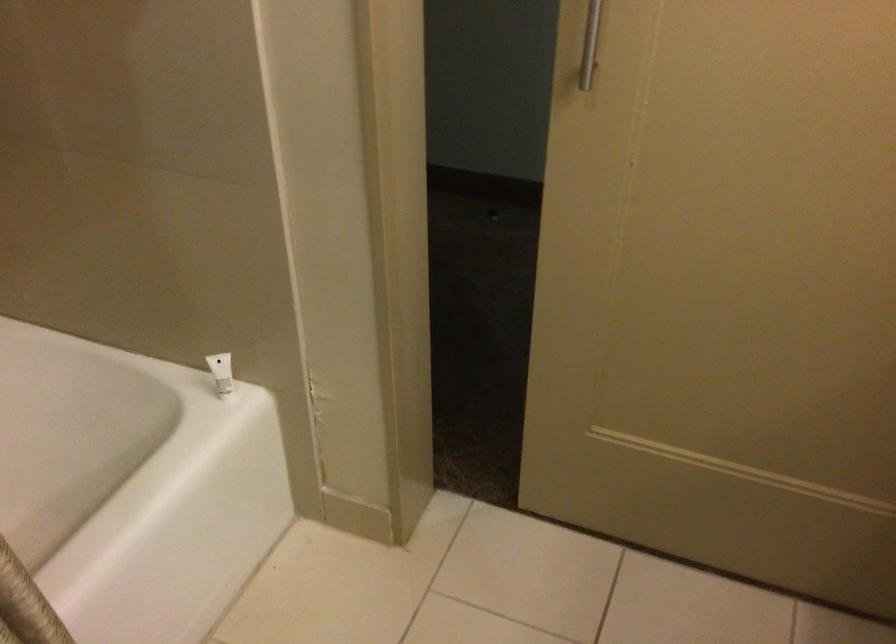
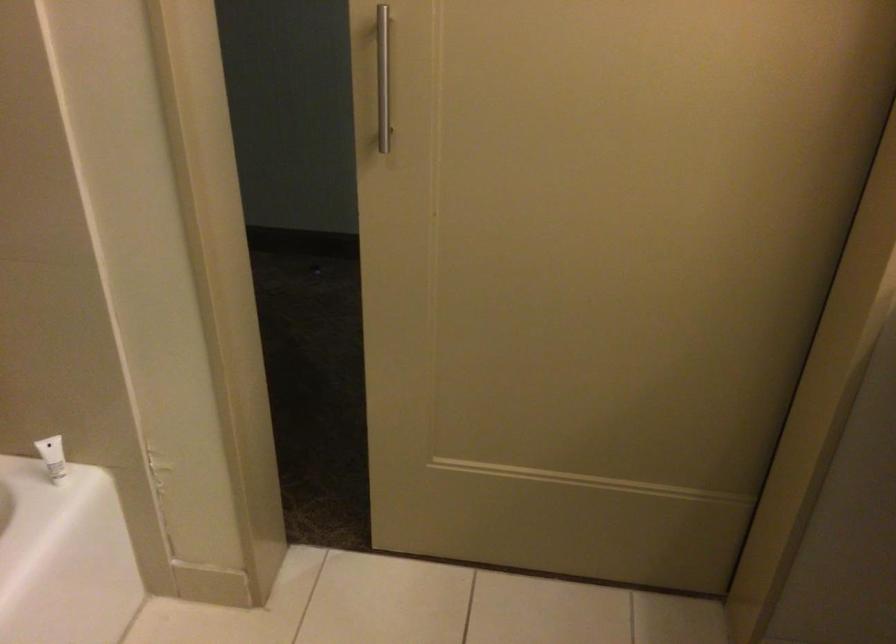
Question: The images are taken continuously from a first-person perspective. In which direction is your viewpoint rotating?

Choices:
 (A) Left
 (B) Right
 (C) Up
 (D) Down

Answer: (B)